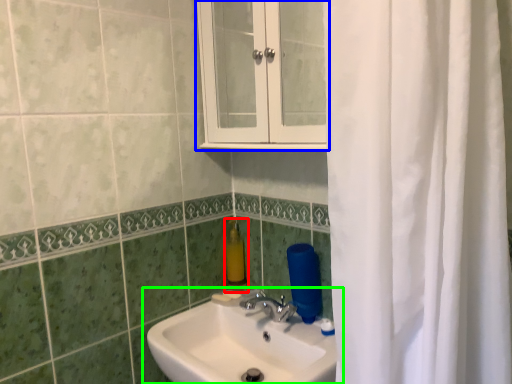
Question: Which object is positioned closest to soap dispenser (highlighted by a red box)? Select from medicine cabinet (highlighted by a blue box) and sink (highlighted by a green box).

Choices:
 (A) medicine cabinet
 (B) sink

Answer: (B)